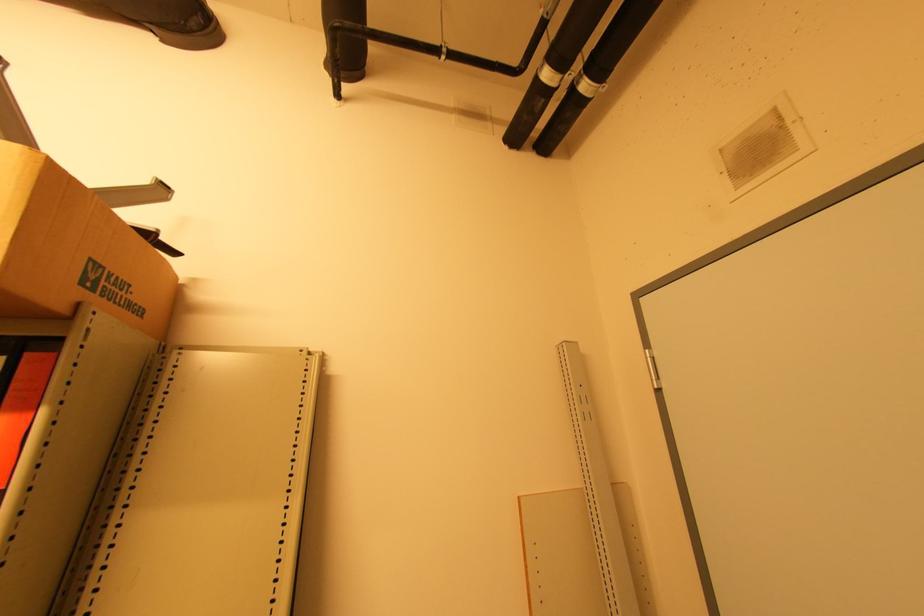
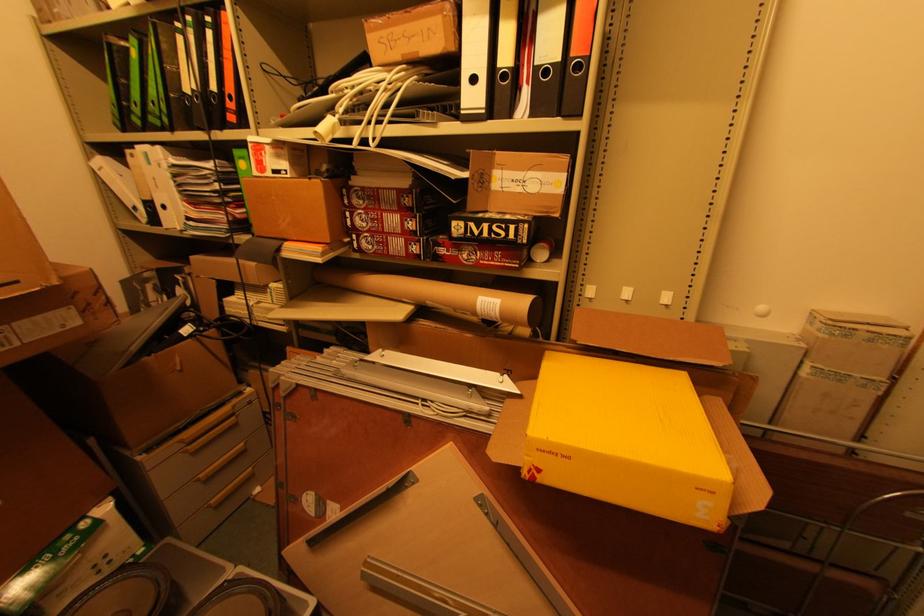
Based on the continuous images, in which direction is the camera rotating?

The camera's rotation is toward left-down.